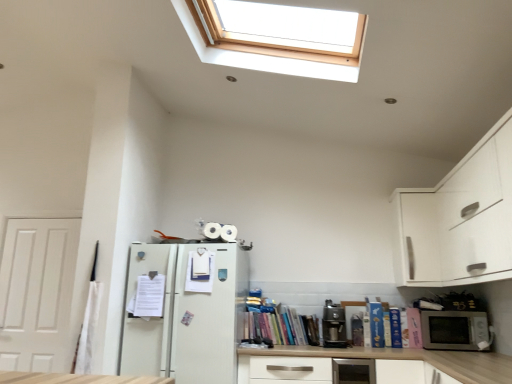
Question: From the image's perspective, is satin silver toaster at lower center above or below hardcover book at right, positioned as the 1th book in right-to-left order?

Choices:
 (A) above
 (B) below

Answer: (B)

Question: Is satin silver toaster at lower center bigger or smaller than hardcover book at right, arranged as the 7th book when viewed from the left?

Choices:
 (A) small
 (B) big

Answer: (B)

Question: Based on their relative distances, which object is nearer to the blue matte book at lower right, which is the 4th book from right to left?

Choices:
 (A) hardcover books at center, placed as the 5th book when sorted from right to left
 (B) blue hardcover book at lower right, which appears as the second book when viewed from the right
 (C) white paper at left, the 1th book positioned from the left
 (D) white matte door at left
 (E) satin silver toaster at lower center

Answer: (B)

Question: Which object is the closest to the white paper at left, the 1th book positioned from the left?

Choices:
 (A) satin silver toaster at lower center
 (B) blue matte book at lower right, which is the 4th book from right to left
 (C) blue hardcover book at lower right, the 6th book from the left
 (D) white matte book at center, the 6th book viewed from the right
 (E) white matte drawer at center

Answer: (D)